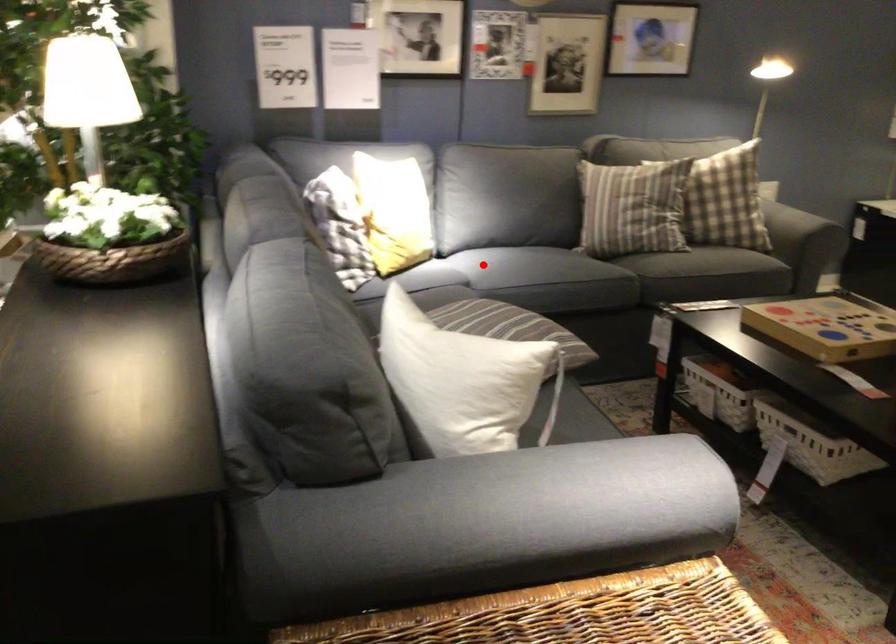
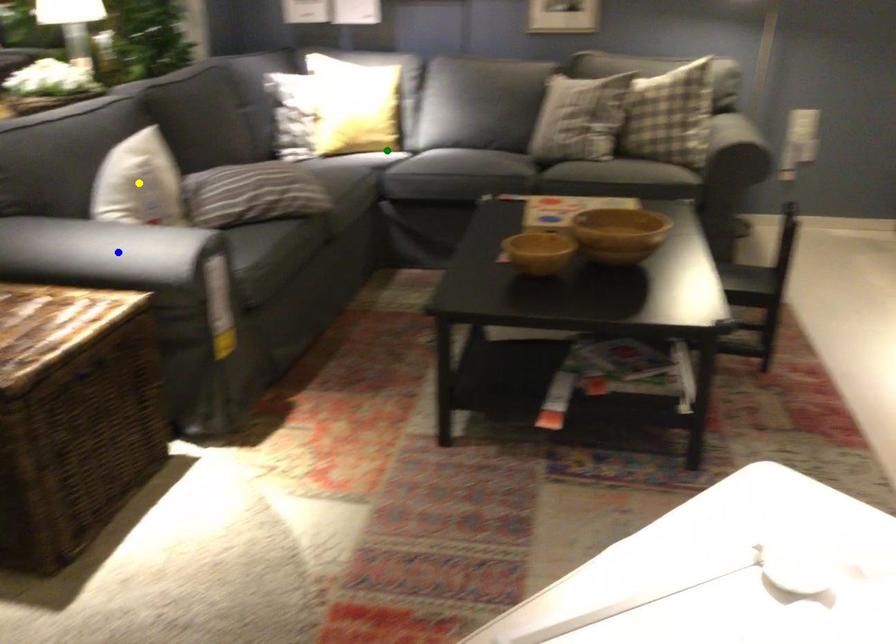
Question: I am providing you with two images of the same scene from different viewpoints. A red point is marked on the first image. You are given multiple points on the second image. In image 2, which mark is for the same physical point as the one in image 1?

Choices:
 (A) green point
 (B) blue point
 (C) yellow point

Answer: (A)